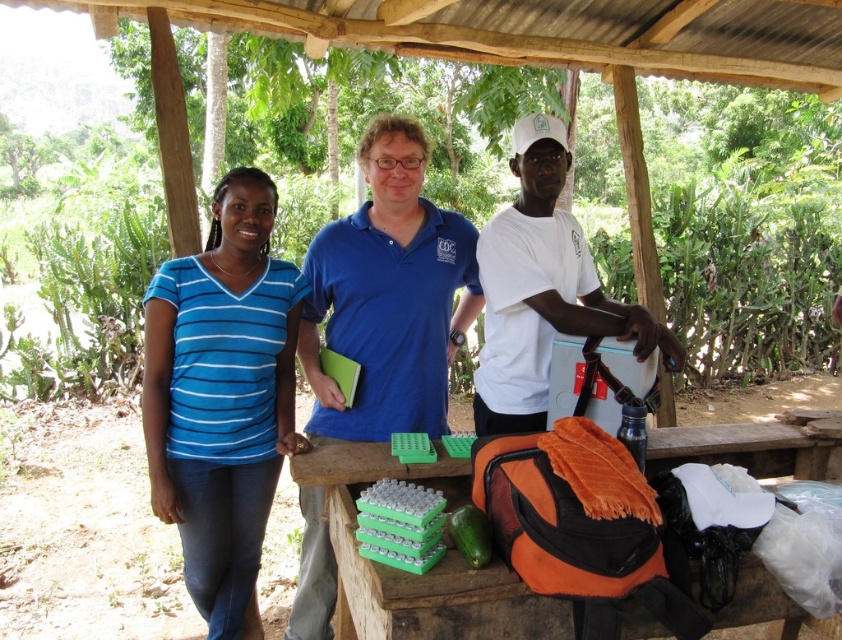
Question: Does blue cotton shirt at center have a greater width compared to orange fabric-covered bag at lower center?

Choices:
 (A) yes
 (B) no

Answer: (B)

Question: Is orange fabric-covered bag at lower center above white matte shirt at center?

Choices:
 (A) yes
 (B) no

Answer: (B)

Question: Can you confirm if blue cotton shirt at center is positioned below orange fabric-covered bag at lower center?

Choices:
 (A) no
 (B) yes

Answer: (A)

Question: Which object appears farthest from the camera in this image?

Choices:
 (A) white matte shirt at center
 (B) orange fabric-covered bag at lower center
 (C) blue striped shirt at left
 (D) blue cotton shirt at center

Answer: (D)

Question: Which object appears farthest from the camera in this image?

Choices:
 (A) orange fabric-covered bag at lower center
 (B) white matte shirt at center

Answer: (B)

Question: Which of the following is the farthest from the observer?

Choices:
 (A) (533, 353)
 (B) (300, 627)
 (C) (148, 316)
 (D) (497, 611)

Answer: (B)